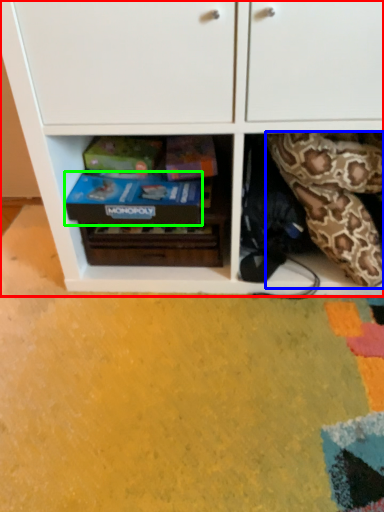
Question: Which object is the closest to the cabinetry (highlighted by a red box)? Choose among these: snake (highlighted by a blue box) or shoe box (highlighted by a green box).

Choices:
 (A) snake
 (B) shoe box

Answer: (B)